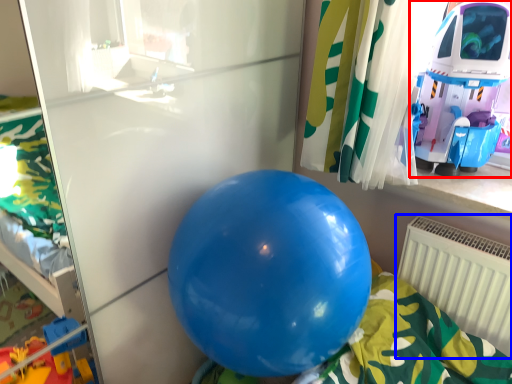
Question: Which of the following is the closest to the observer, toy (highlighted by a red box) or radiator (highlighted by a blue box)?

Choices:
 (A) toy
 (B) radiator

Answer: (A)